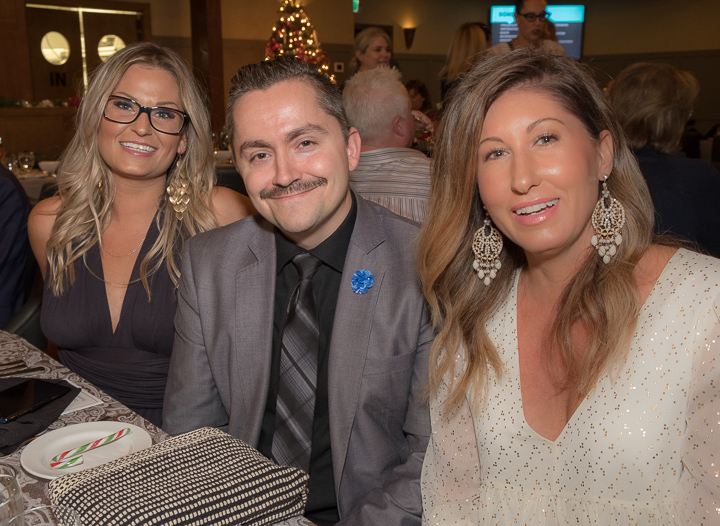
Identify the location of windows. The image size is (720, 526). (53, 52), (111, 47).